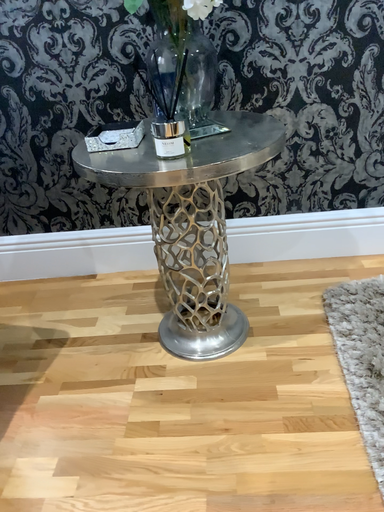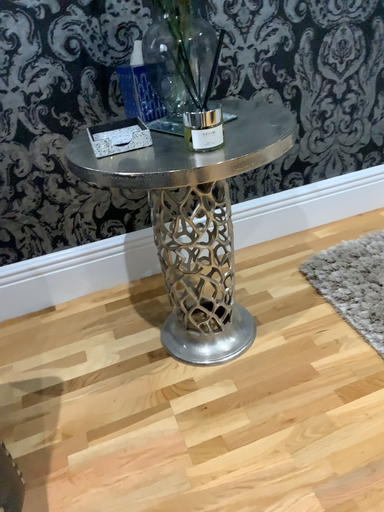
Question: How did the camera likely rotate when shooting the video?

Choices:
 (A) rotated left
 (B) rotated right

Answer: (B)